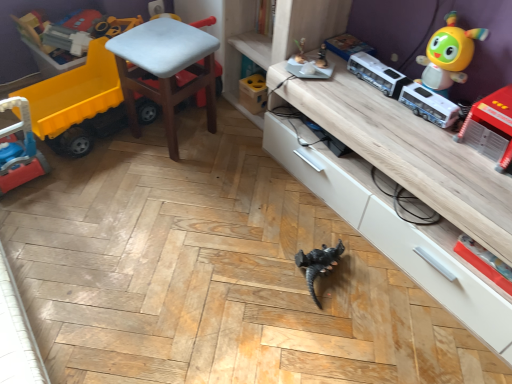
You are a GUI agent. You are given a task and a screenshot of the screen. Output one action in this format:
    pyautogui.click(x=<x>, y=<y>)
    Task: Click on the free space to the left of white plastic bus at upper right
    
    Given the screenshot: What is the action you would take?
    pyautogui.click(x=358, y=94)